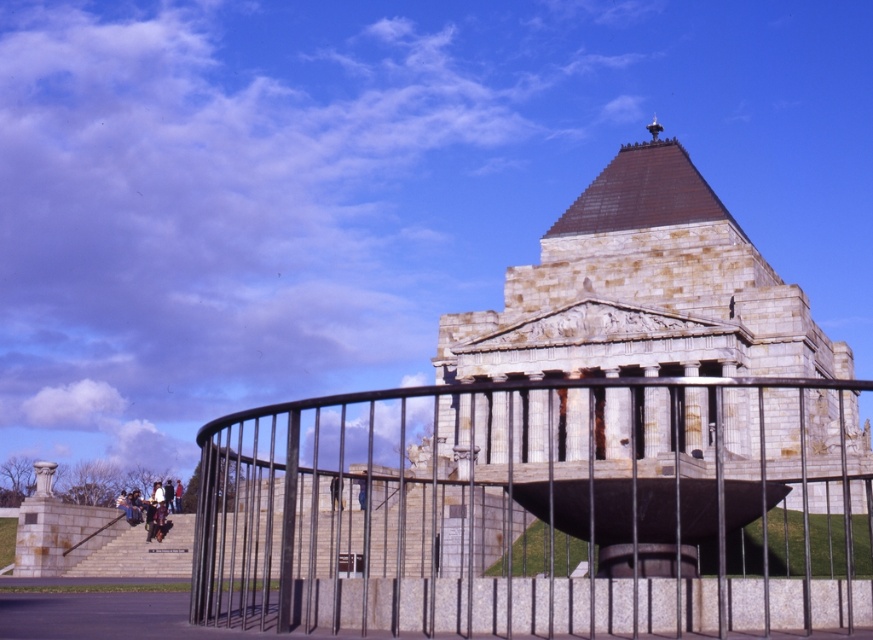
You are a security guard at the memorial. You notice a dark brown leather jacket at center left unattended. There is also a metallic black fence at center that separates visitors from the monument. Can you determine if the jacket is within the restricted area defined by the fence?

The metallic black fence at center and dark brown leather jacket at center are 59.15 feet apart. Since the jacket is more than 59 feet away from the fence, it is likely outside the restricted area defined by the fence.

You are a tour guide leading a group to the monument. You notice a visitor is standing on the light gray stone stairs at lower left and wants to reach the dark brown leather jacket at center. Can they walk directly to it without stepping off the stairs?

The light gray stone stairs at lower left and dark brown leather jacket at center are 12.84 meters apart from each other, so the visitor would need to walk 12.84 meters to reach it. They can walk directly to it as long as the path between them is accessible and not obstructed.

You are standing at the entrance of the monument and want to walk towards the metallic black fence at center. Which direction should you head?

The metallic black fence at center is located at point (521,509) in the image, so you should head towards the center of the image to reach it.